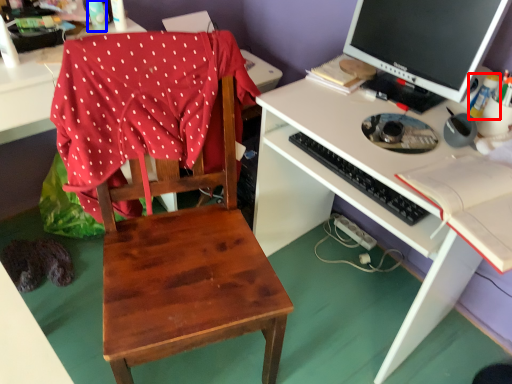
Question: Which point is further to the camera, bottle (highlighted by a red box) or bottle (highlighted by a blue box)?

Choices:
 (A) bottle
 (B) bottle

Answer: (B)